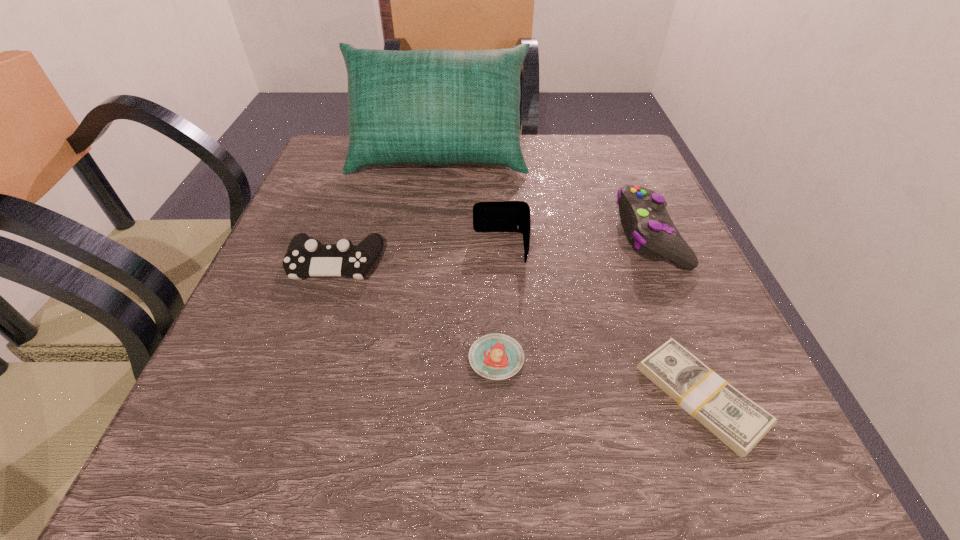
Image resolution: width=960 pixels, height=540 pixels. Identify the location of control that is positioned at the right edge. coord(644,217).

Identify the location of dollar present at the right edge. The width and height of the screenshot is (960, 540). (737, 421).

Locate an element on the screen. The width and height of the screenshot is (960, 540). object present at the far left corner is located at coordinates (434, 107).

The width and height of the screenshot is (960, 540). What are the coordinates of `object located in the near right corner section of the desktop` in the screenshot? It's located at (737, 421).

I want to click on blank space at the far edge of the desktop, so click(x=431, y=172).

The image size is (960, 540). In the image, there is a desktop. In order to click on vacant space at the near edge in this screenshot , I will do `click(612, 454)`.

At what (x,y) coordinates should I click in order to perform the action: click on free space at the left edge. Please return your answer as a coordinate pair (x, y). The image size is (960, 540). Looking at the image, I should click on (x=274, y=278).

I want to click on free space at the right edge of the desktop, so click(x=636, y=312).

At what (x,y) coordinates should I click in order to perform the action: click on vacant space at the far left corner of the desktop. Please return your answer as a coordinate pair (x, y). The image size is (960, 540). Looking at the image, I should click on (329, 135).

You are a GUI agent. You are given a task and a screenshot of the screen. Output one action in this format:
    pyautogui.click(x=<x>, y=<y>)
    Task: Click on the vacant space at the far right corner of the desktop
    The height and width of the screenshot is (540, 960).
    Given the screenshot: What is the action you would take?
    pyautogui.click(x=601, y=167)